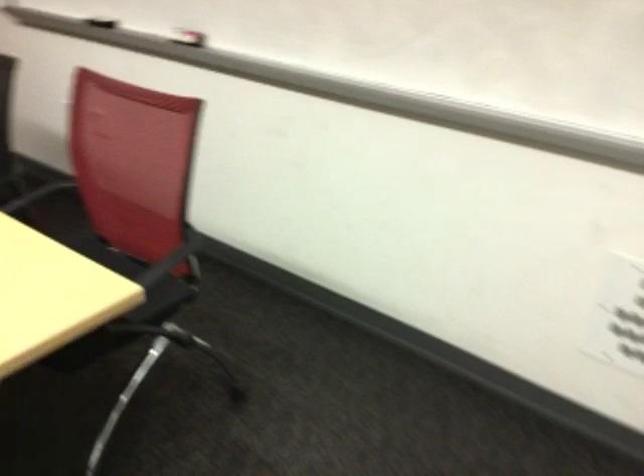
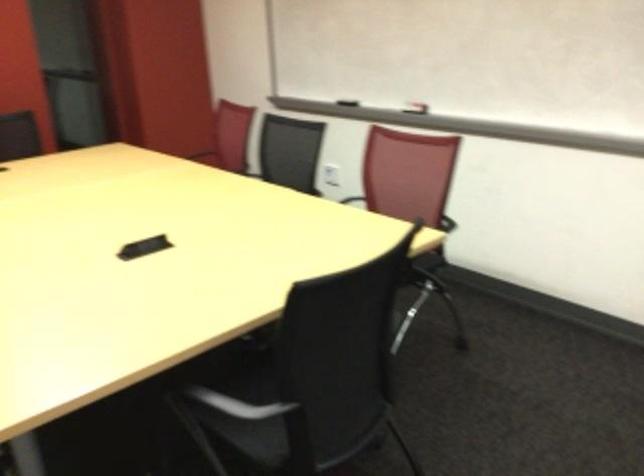
Question: Based on the continuous images, in which direction is the camera rotating? Reply with the corresponding letter.

Choices:
 (A) Left
 (B) Right
 (C) Up
 (D) Down

Answer: (A)